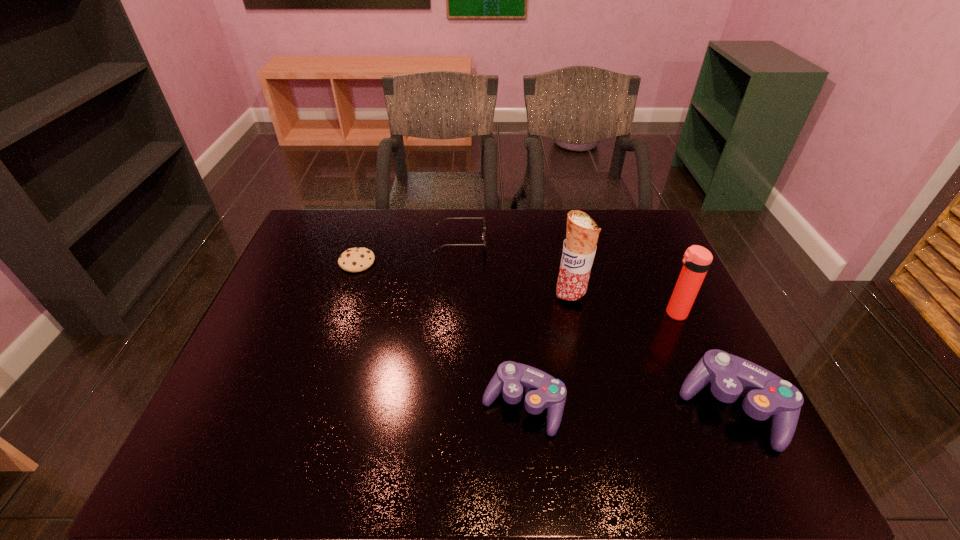
What are the coordinates of `free space that satisfies the following two spatial constraints: 1. on the front side of the cookie; 2. on the right side of the third object from right to left` in the screenshot? It's located at (347, 296).